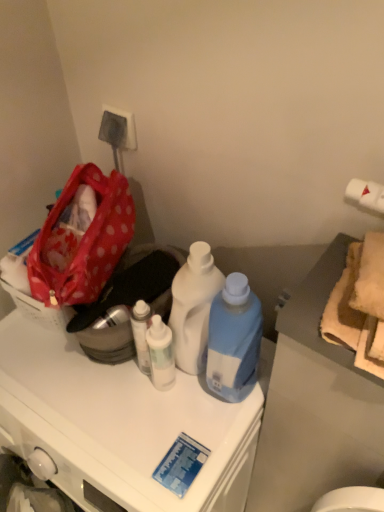
Identify the location of vacant region in front of blue plastic bottle at center, the 1th bottle when ordered from right to left. (206, 442).